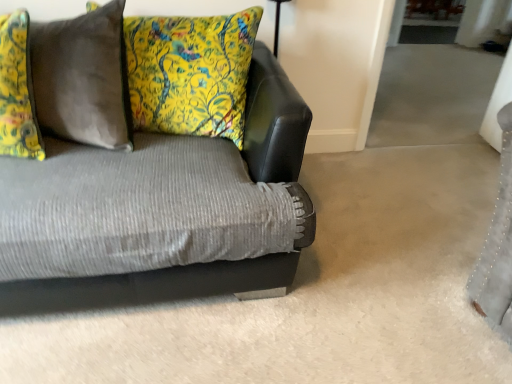
Question: Can we say textured gray couch at center lies outside floral fabric pillow at left, the 3th pillow from the right?

Choices:
 (A) yes
 (B) no

Answer: (A)

Question: Is textured gray couch at center positioned with its back to floral fabric pillow at left, which is the first pillow in left-to-right order?

Choices:
 (A) yes
 (B) no

Answer: (A)

Question: Is textured gray couch at center facing towards floral fabric pillow at left, the 3th pillow from the right?

Choices:
 (A) no
 (B) yes

Answer: (A)

Question: From the image's perspective, is textured gray couch at center located beneath floral fabric pillow at left, which is the first pillow in left-to-right order?

Choices:
 (A) yes
 (B) no

Answer: (A)

Question: Is textured gray couch at center in front of floral fabric pillow at left, the 3th pillow from the right?

Choices:
 (A) yes
 (B) no

Answer: (A)

Question: From a real-world perspective, does textured gray couch at center stand above floral fabric pillow at left, which is the first pillow in left-to-right order?

Choices:
 (A) yes
 (B) no

Answer: (B)

Question: From a real-world perspective, does floral fabric pillow at left, the 3th pillow from the right, stand above textured gray couch at center?

Choices:
 (A) yes
 (B) no

Answer: (A)

Question: Is floral fabric pillow at left, which is the first pillow in left-to-right order, in front of textured gray couch at center?

Choices:
 (A) no
 (B) yes

Answer: (A)

Question: Is textured gray couch at center completely or partially inside floral fabric pillow at left, which is the first pillow in left-to-right order?

Choices:
 (A) yes
 (B) no

Answer: (B)

Question: From the image's perspective, is floral fabric pillow at left, which is the first pillow in left-to-right order, over textured gray couch at center?

Choices:
 (A) no
 (B) yes

Answer: (B)

Question: Is floral fabric pillow at left, which is the first pillow in left-to-right order, not close to textured gray couch at center?

Choices:
 (A) yes
 (B) no

Answer: (B)

Question: From the image's perspective, does floral fabric pillow at left, the 3th pillow from the right, appear lower than textured gray couch at center?

Choices:
 (A) no
 (B) yes

Answer: (A)

Question: Is textured gray couch at center not near velvet gray pillow at upper left, the 2th pillow positioned from the left?

Choices:
 (A) no
 (B) yes

Answer: (A)